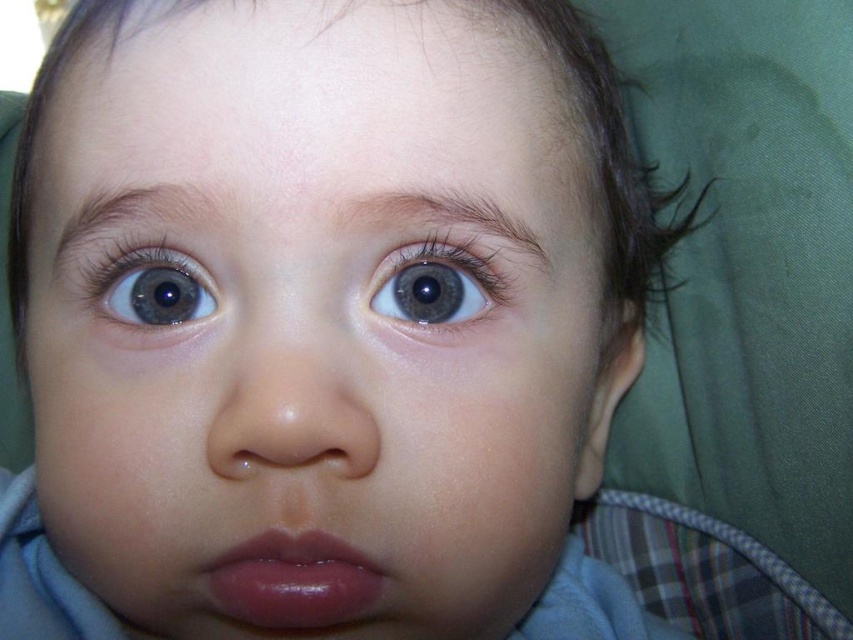
Who is positioned more to the right, smooth skin face at center or blue glossy eye at upper left?

From the viewer's perspective, smooth skin face at center appears more on the right side.

Which is in front, point (495, 84) or point (169, 308)?

Point (495, 84) is more forward.

Is point (248, 360) less distant than point (167, 310)?

Yes, it is.

Identify the location of smooth skin face at center. (315, 320).

Measure the distance from smooth skin face at center to blue glossy eye at upper center.

smooth skin face at center is 3.02 inches from blue glossy eye at upper center.

Can you confirm if smooth skin face at center is taller than blue glossy eye at upper center?

Correct, smooth skin face at center is much taller as blue glossy eye at upper center.

Image resolution: width=853 pixels, height=640 pixels. Identify the location of smooth skin face at center. (315, 320).

You are a GUI agent. You are given a task and a screenshot of the screen. Output one action in this format:
    pyautogui.click(x=<x>, y=<y>)
    Task: Click on the smooth skin face at center
    The height and width of the screenshot is (640, 853).
    Given the screenshot: What is the action you would take?
    pyautogui.click(x=315, y=320)

Is point (310, 600) positioned in front of point (117, 312)?

That is True.

Can you confirm if glossy pink lips at center is positioned above blue glossy eye at upper left?

Incorrect, glossy pink lips at center is not positioned above blue glossy eye at upper left.

Measure the distance between point (233, 582) and camera.

The distance of point (233, 582) from camera is 10.84 inches.

Find the location of a particular element. The height and width of the screenshot is (640, 853). glossy pink lips at center is located at coordinates (293, 582).